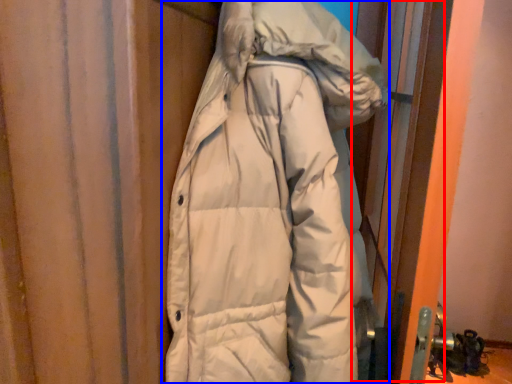
Question: Which of the following is the farthest to the observer, screen door (highlighted by a red box) or jacket (highlighted by a blue box)?

Choices:
 (A) screen door
 (B) jacket

Answer: (A)